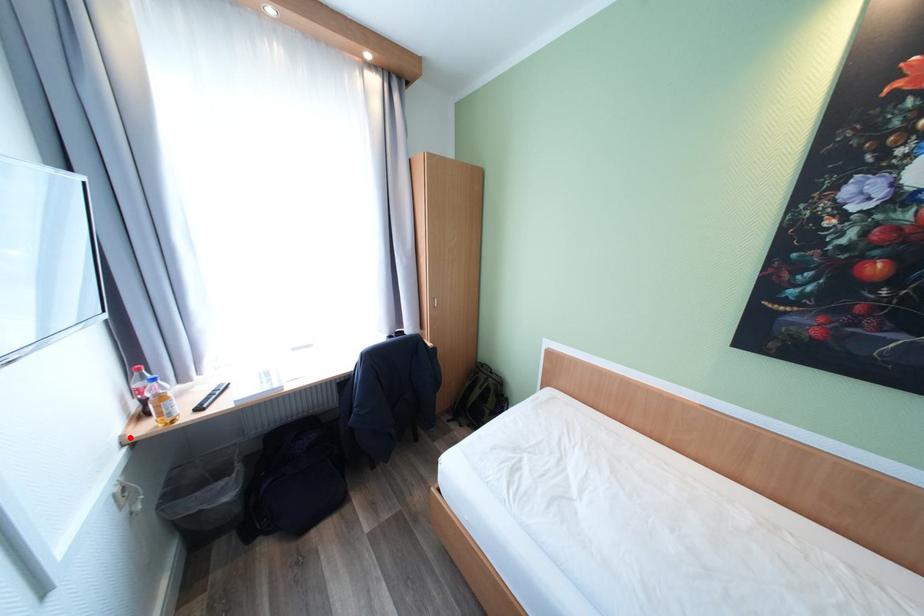
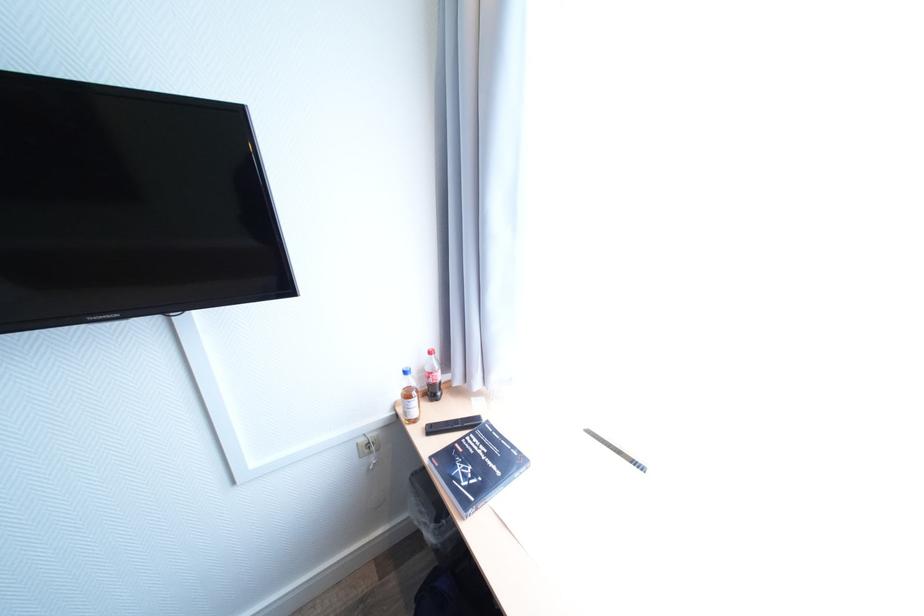
Where in the second image is the point corresponding to the highlighted location from the first image?

(403, 403)